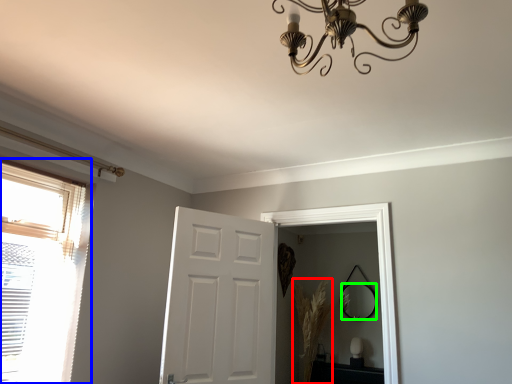
Question: Based on their relative distances, which object is farther from plant (highlighted by a red box)? Choose from window (highlighted by a blue box) and mirror (highlighted by a green box).

Choices:
 (A) window
 (B) mirror

Answer: (A)